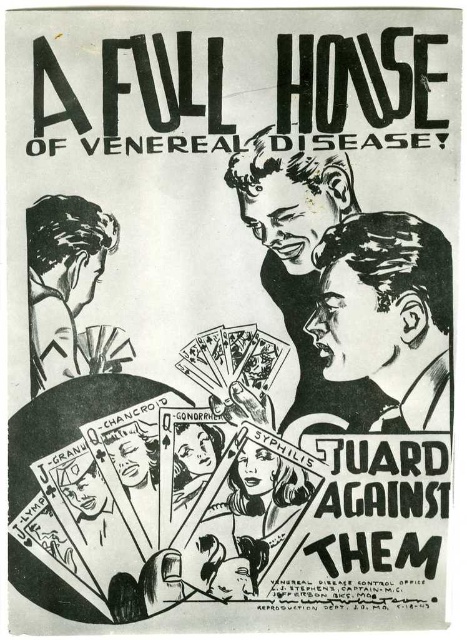
Is smooth black face at lower right to the left of black ink drawing of man at center from the viewer's perspective?

Incorrect, smooth black face at lower right is not on the left side of black ink drawing of man at center.

Between point (425, 323) and point (342, 184), which one is positioned behind?

Positioned behind is point (425, 323).

Where is `smooth black face at lower right`? smooth black face at lower right is located at coordinates (388, 310).

Who is positioned more to the right, black ink drawing of man at center or smooth black hair at left?

From the viewer's perspective, black ink drawing of man at center appears more on the right side.

Looking at this image, is black ink drawing of man at center to the left of smooth black hair at left from the viewer's perspective?

In fact, black ink drawing of man at center is to the right of smooth black hair at left.

Does point (290, 164) come closer to viewer compared to point (40, 305)?

No, it is behind (40, 305).

This screenshot has height=640, width=467. Identify the location of black ink drawing of man at center. (301, 260).

Who is shorter, smooth black face at lower right or smooth black hair at left?

With less height is smooth black hair at left.

Which is behind, point (425, 252) or point (42, 326)?

The point (425, 252) is more distant.

Does point (431, 330) lie in front of point (98, 237)?

That is False.

Find the location of a particular element. smooth black face at lower right is located at coordinates (388, 310).